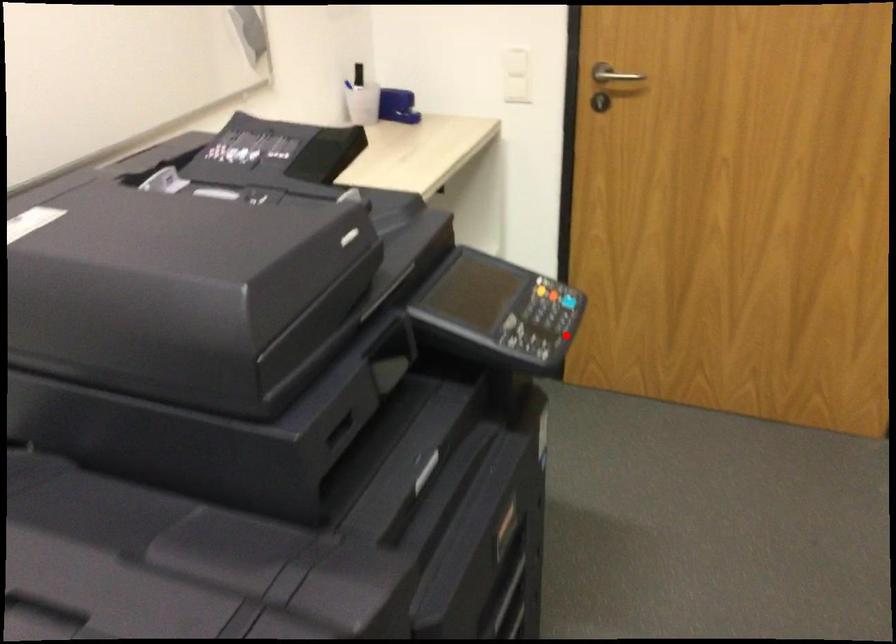
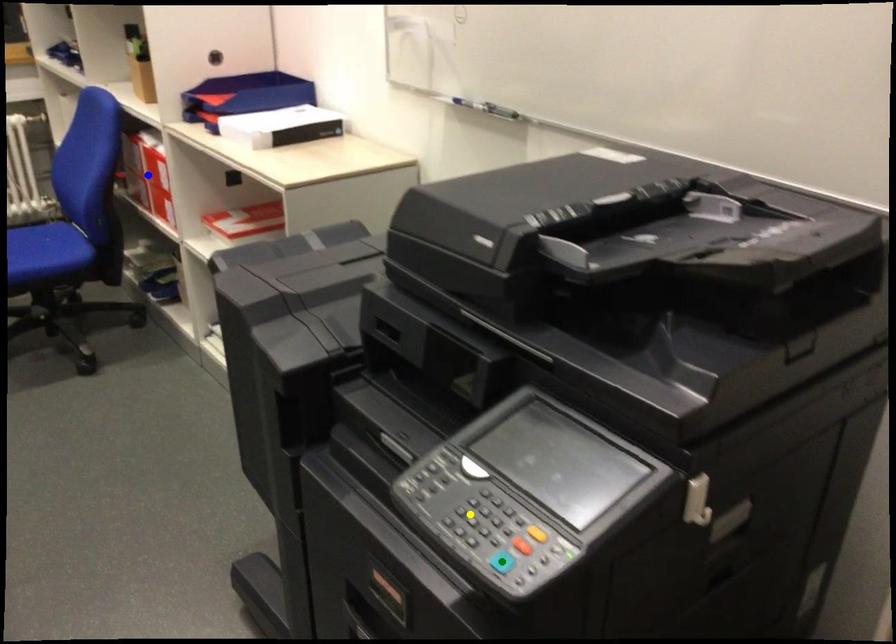
Question: I am providing you with two images of the same scene from different viewpoints. A red point is marked on the first image. You are given multiple points on the second image. In image 2, which mark is for the same physical point as the one in image 1?

Choices:
 (A) yellow point
 (B) green point
 (C) blue point

Answer: (B)